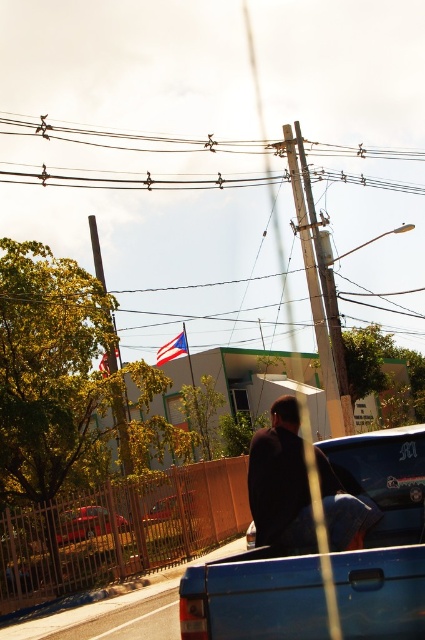
You are a delivery driver who needs to park your truck next to the blue matte truck at center. The parking space is narrow. Can you safely park your truck if your truck is as wide as the brown wooden power line at upper center?

The blue matte truck at center is thinner than the brown wooden power line at upper center. Since your truck is as wide as the brown wooden power line at upper center, it would be wider than the blue matte truck at center. Therefore, you should be able to park safely as long as the parking space accommodates the width of the brown wooden power line at upper center.

You are a photographer trying to capture both the dark blue jeans at center and the metallic red car at lower left in the same frame. Based on their heights, which object should you focus on first to ensure both are in focus?

The dark blue jeans at center has a greater height compared to the metallic red car at lower left, so you should focus on the dark blue jeans at center first to ensure both are in focus.

You are a photographer standing on the sidewalk. You want to take a photo of the metallic red car at center without the brown wooden power line at upper center appearing in the frame. Is it possible to do so by moving your position? Explain your reasoning.

The brown wooden power line at upper center is in front of the metallic red car at center, so moving your position might allow you to angle the camera such that the power line is no longer blocking the view of the car. By shifting sideways or adjusting your viewpoint, you could potentially frame the shot to exclude the power line while still capturing the car.